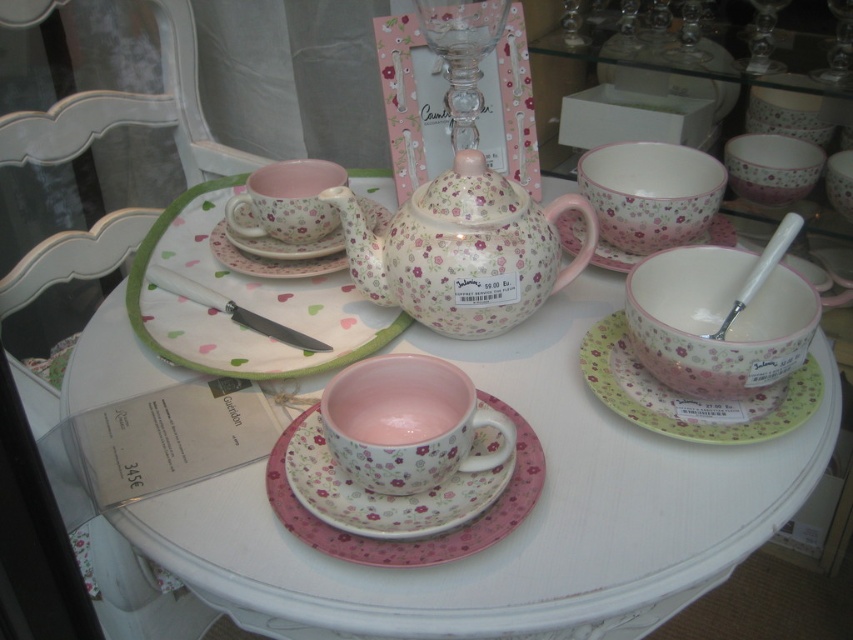
You are a tea lover who wants to pour tea from the teapot into the matte pink porcelain teacup at center. The teapot is located at the center of the table. Can you reach the pink ceramic saucer at center without moving the teapot?

The matte pink porcelain teacup at center is 33.57 centimeters away from the pink ceramic saucer at center. Since the teapot is at the center, you can easily reach the saucer without moving the teapot as the distance is manageable.

You are a tea enthusiast who wants to place a new teacup exactly at the center of the table. The table has a coordinate system where the bottom left corner is the origin. The existing pink floral porcelain teacup at center is located at point (650, 193). Is this point the exact center of the table?

The pink floral porcelain teacup at center is located at point (650, 193), which is the exact center of the table according to the coordinate system provided.

You are a tea lover who wants to place a sugar cube into the matte pink porcelain teacup at center. Given that the sugar bowl is located to the right of the teapot, can you determine the direction you should move towards to reach the sugar bowl from the teacup?

The sugar bowl is located to the right of the teapot, which is centrally positioned. Since the matte pink porcelain teacup at center is at point (288,200), you should move towards the right direction to reach the sugar bowl from the teacup.